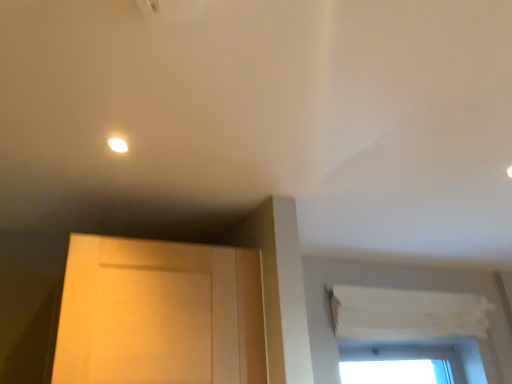
Describe the element at coordinates (407, 316) in the screenshot. This screenshot has height=384, width=512. I see `white paper at upper right` at that location.

At what (x,y) coordinates should I click in order to perform the action: click on white paper at upper right. Please return your answer as a coordinate pair (x, y). Image resolution: width=512 pixels, height=384 pixels. Looking at the image, I should click on (407, 316).

At what (x,y) coordinates should I click in order to perform the action: click on white paper at upper right. Please return your answer as a coordinate pair (x, y). Looking at the image, I should click on (407, 316).